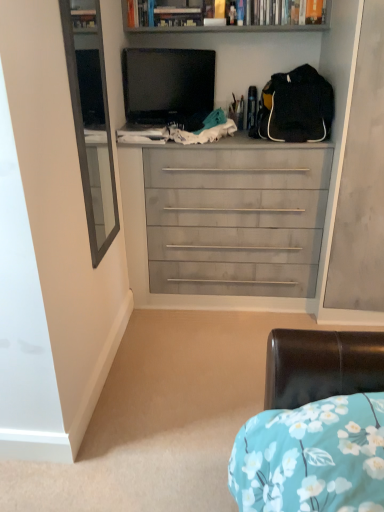
Question: Are wooden bookshelf at upper center and hardcover book at upper center located far from each other?

Choices:
 (A) no
 (B) yes

Answer: (A)

Question: Does wooden bookshelf at upper center have a greater height compared to hardcover book at upper center?

Choices:
 (A) no
 (B) yes

Answer: (A)

Question: Is wooden bookshelf at upper center facing towards hardcover book at upper center?

Choices:
 (A) yes
 (B) no

Answer: (A)

Question: Considering the relative sizes of wooden bookshelf at upper center and hardcover book at upper center in the image provided, is wooden bookshelf at upper center smaller than hardcover book at upper center?

Choices:
 (A) yes
 (B) no

Answer: (B)

Question: Is wooden bookshelf at upper center completely or partially outside of hardcover book at upper center?

Choices:
 (A) yes
 (B) no

Answer: (A)

Question: From the image's perspective, is black matte backpack at upper right above or below matte black tv at upper center?

Choices:
 (A) below
 (B) above

Answer: (A)

Question: From a real-world perspective, is black matte backpack at upper right physically located above or below matte black tv at upper center?

Choices:
 (A) above
 (B) below

Answer: (B)

Question: Considering the positions of point (309, 109) and point (144, 92), is point (309, 109) closer or farther from the camera than point (144, 92)?

Choices:
 (A) farther
 (B) closer

Answer: (B)

Question: In terms of width, does black matte backpack at upper right look wider or thinner when compared to matte black tv at upper center?

Choices:
 (A) thin
 (B) wide

Answer: (B)

Question: Would you say matte gray chest of drawers at center is inside or outside wooden bookshelf at upper center?

Choices:
 (A) outside
 (B) inside

Answer: (A)

Question: Is matte gray chest of drawers at center to the left or to the right of wooden bookshelf at upper center in the image?

Choices:
 (A) left
 (B) right

Answer: (A)

Question: In terms of height, does matte gray chest of drawers at center look taller or shorter compared to wooden bookshelf at upper center?

Choices:
 (A) tall
 (B) short

Answer: (A)

Question: In terms of width, does matte gray chest of drawers at center look wider or thinner when compared to wooden bookshelf at upper center?

Choices:
 (A) thin
 (B) wide

Answer: (B)

Question: Considering the positions of matte gray chest of drawers at center and matte black tv at upper center in the image, is matte gray chest of drawers at center taller or shorter than matte black tv at upper center?

Choices:
 (A) short
 (B) tall

Answer: (B)

Question: From a real-world perspective, is matte gray chest of drawers at center physically located above or below matte black tv at upper center?

Choices:
 (A) below
 (B) above

Answer: (A)